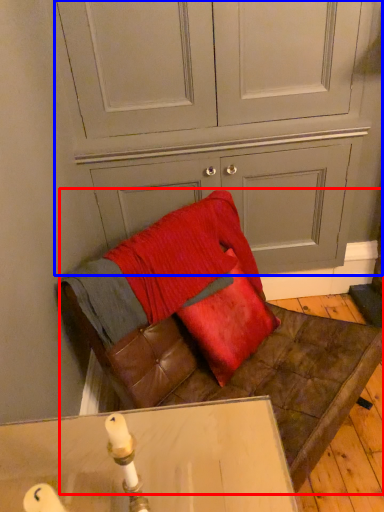
Question: Among these objects, which one is nearest to the camera, furniture (highlighted by a red box) or dresser (highlighted by a blue box)?

Choices:
 (A) furniture
 (B) dresser

Answer: (A)